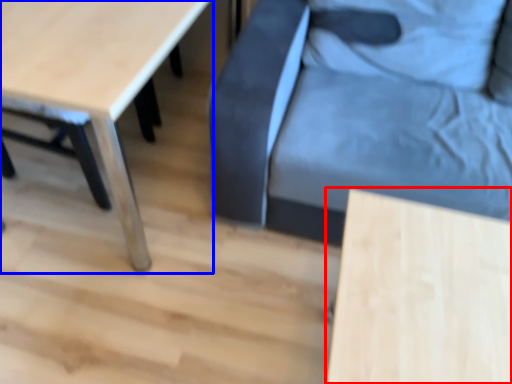
Question: Which object appears closest to the camera in this image, table (highlighted by a red box) or table (highlighted by a blue box)?

Choices:
 (A) table
 (B) table

Answer: (A)